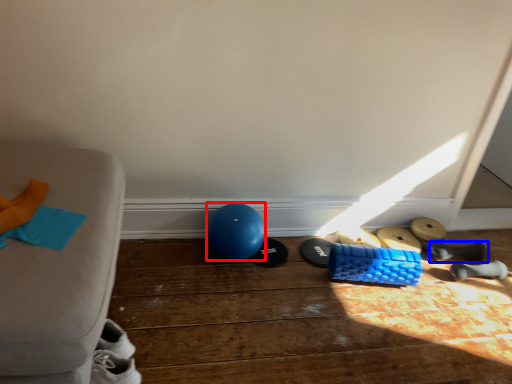
Question: Among these objects, which one is farthest to the camera, balloon (highlighted by a red box) or footwear (highlighted by a blue box)?

Choices:
 (A) balloon
 (B) footwear

Answer: (B)